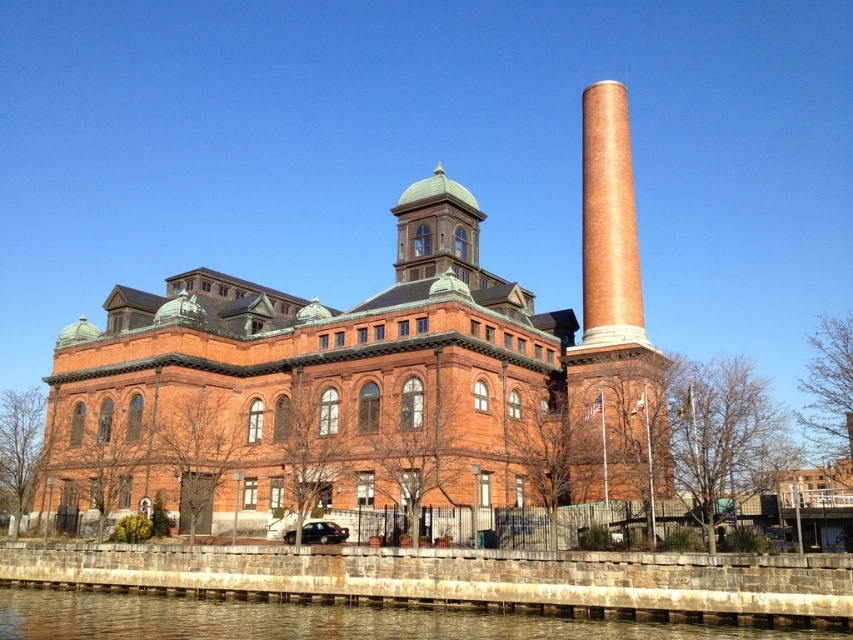
Question: Observing the image, what is the correct spatial positioning of brick chimney at right in reference to brown stone wall at lower left?

Choices:
 (A) right
 (B) left

Answer: (A)

Question: Which of the following is the closest to the observer?

Choices:
 (A) (688, 621)
 (B) (619, 141)

Answer: (A)

Question: Can you confirm if brick chimney at right is thinner than brown stone wall at lower left?

Choices:
 (A) no
 (B) yes

Answer: (B)

Question: Is brick chimney at right positioned before brown stone wall at lower left?

Choices:
 (A) no
 (B) yes

Answer: (A)